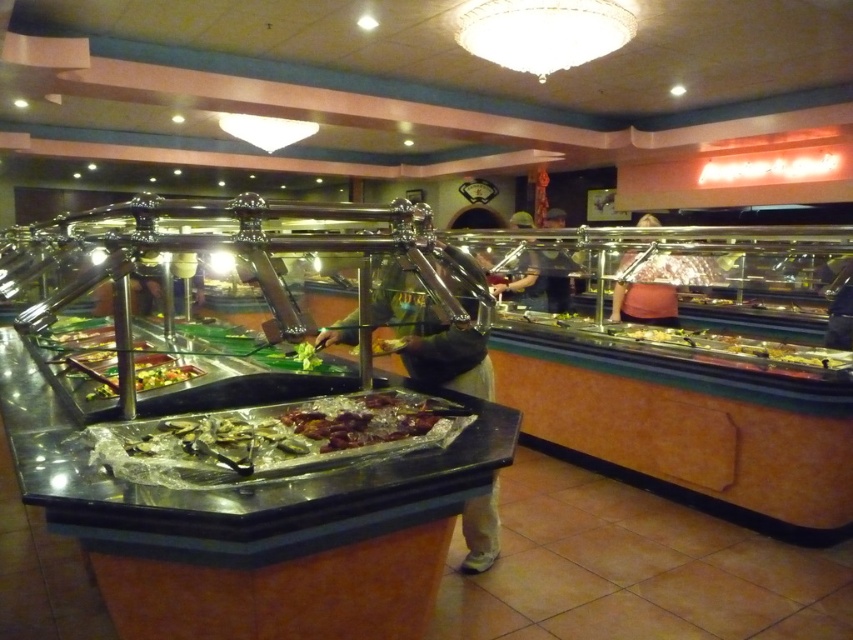
Which is more to the right, shiny metallic meat at center or green leafy vegetables at center?

shiny metallic meat at center

Who is more forward, (355, 433) or (102, 396)?

Point (355, 433) is more forward.

The width and height of the screenshot is (853, 640). What are the coordinates of `shiny metallic meat at center` in the screenshot? It's located at (361, 419).